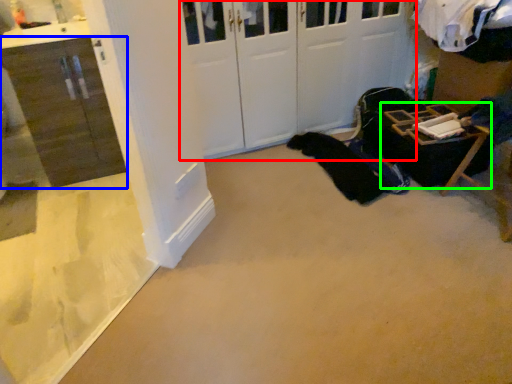
Question: Estimate the real-world distances between objects in this image. Which object is farther from door (highlighted by a red box), cabinetry (highlighted by a blue box) or furniture (highlighted by a green box)?

Choices:
 (A) cabinetry
 (B) furniture

Answer: (A)